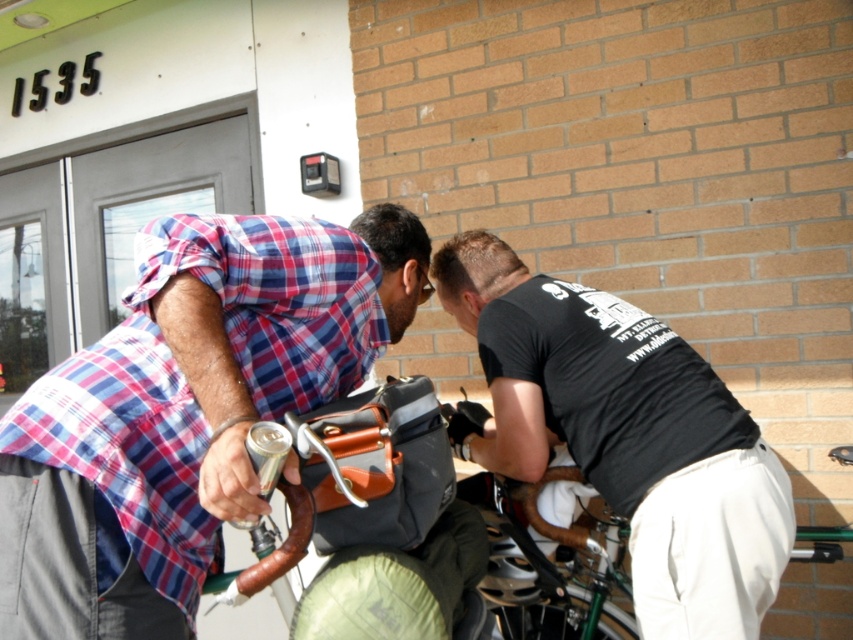
Does black matte shirt at center appear over green metallic bicycle at lower center?

Correct, black matte shirt at center is located above green metallic bicycle at lower center.

Is the position of black matte shirt at center less distant than that of green metallic bicycle at lower center?

Yes, black matte shirt at center is closer to the viewer.

Locate an element on the screen. Image resolution: width=853 pixels, height=640 pixels. black matte shirt at center is located at coordinates (625, 435).

What are the coordinates of `black matte shirt at center` in the screenshot? It's located at (625, 435).

Who is taller, plaid shirt at center or green metallic bicycle at lower center?

plaid shirt at center is taller.

At what (x,y) coordinates should I click in order to perform the action: click on plaid shirt at center. Please return your answer as a coordinate pair (x, y). Looking at the image, I should click on (186, 410).

Measure the distance between point (x=115, y=404) and camera.

A distance of 1.36 meters exists between point (x=115, y=404) and camera.

The height and width of the screenshot is (640, 853). What are the coordinates of `plaid shirt at center` in the screenshot? It's located at (186, 410).

Is plaid shirt at center shorter than black matte shirt at center?

Yes, plaid shirt at center is shorter than black matte shirt at center.

Is the position of plaid shirt at center less distant than that of black matte shirt at center?

Yes, it is in front of black matte shirt at center.

What do you see at coordinates (186, 410) in the screenshot? This screenshot has width=853, height=640. I see `plaid shirt at center` at bounding box center [186, 410].

Identify the location of plaid shirt at center. (186, 410).